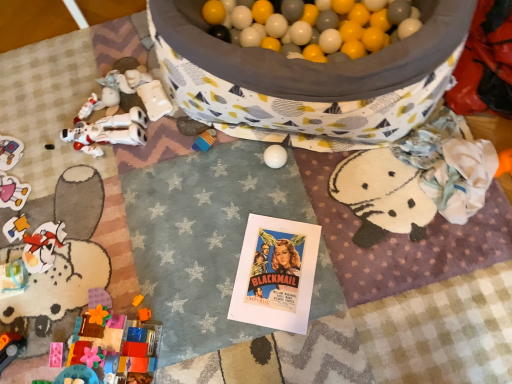
The image size is (512, 384). I want to click on free spot to the right of orange plastic car at lower left, positioned as the fourth toy in top-to-bottom order, so click(49, 339).